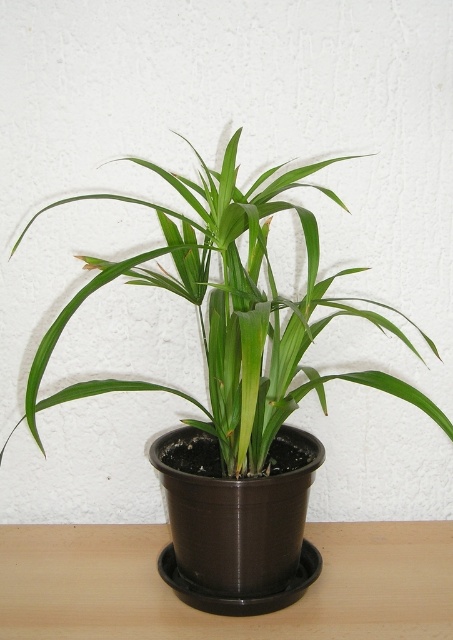
Question: Which point appears farthest from the camera in this image?

Choices:
 (A) (59, 333)
 (B) (398, 522)

Answer: (B)

Question: Which object appears closest to the camera in this image?

Choices:
 (A) brown wooden table at center
 (B) green matte plant at center

Answer: (B)

Question: Which point is farther to the camera?

Choices:
 (A) green matte plant at center
 (B) brown wooden table at center

Answer: (B)

Question: Observing the image, what is the correct spatial positioning of green matte plant at center in reference to brown wooden table at center?

Choices:
 (A) right
 (B) left

Answer: (B)

Question: Considering the relative positions of green matte plant at center and brown wooden table at center in the image provided, where is green matte plant at center located with respect to brown wooden table at center?

Choices:
 (A) left
 (B) right

Answer: (A)

Question: Does green matte plant at center have a greater width compared to brown wooden table at center?

Choices:
 (A) no
 (B) yes

Answer: (A)